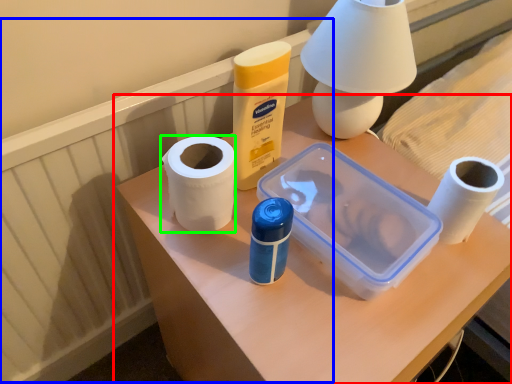
Question: Estimate the real-world distances between objects in this image. Which object is farther from table (highlighted by a red box), radiator (highlighted by a blue box) or paper towel (highlighted by a green box)?

Choices:
 (A) radiator
 (B) paper towel

Answer: (A)